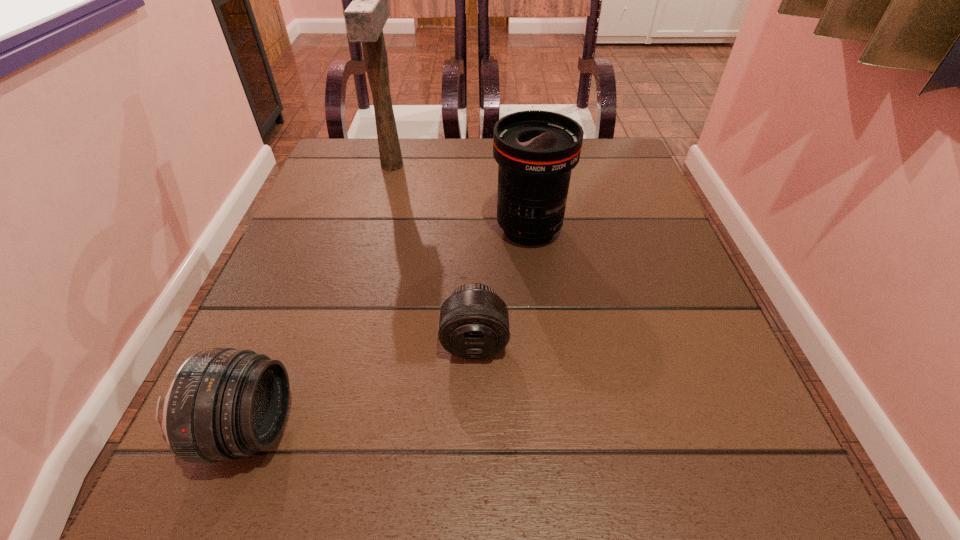
Find the location of a particular element. The width and height of the screenshot is (960, 540). free region at the right edge of the desktop is located at coordinates (668, 289).

The image size is (960, 540). Identify the location of vacant region at the near left corner. (305, 471).

Identify the location of free space at the far right corner of the desktop. (606, 143).

Locate an element on the screen. The image size is (960, 540). vacant space that is in between the farthest telephoto lens and the farthest object is located at coordinates (461, 197).

Identify the location of vacant area that lies between the farthest telephoto lens and the leftmost telephoto lens. (389, 329).

This screenshot has width=960, height=540. In order to click on vacant space that is in between the tallest object and the third shortest object in this screenshot , I will do `click(461, 197)`.

Locate an element on the screen. The height and width of the screenshot is (540, 960). vacant space that is in between the mallet and the tallest telephoto lens is located at coordinates (461, 197).

Where is `unoccupied position between the shortest telephoto lens and the second object from left to right`? The width and height of the screenshot is (960, 540). unoccupied position between the shortest telephoto lens and the second object from left to right is located at coordinates (433, 254).

The image size is (960, 540). Identify the location of free space between the farthest telephoto lens and the mallet. (461, 197).

Image resolution: width=960 pixels, height=540 pixels. Identify the location of vacant area that lies between the third tallest object and the tallest telephoto lens. (389, 329).